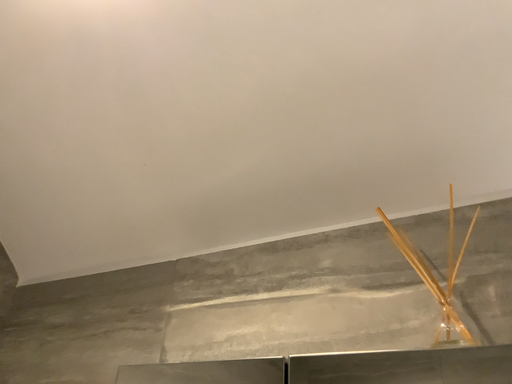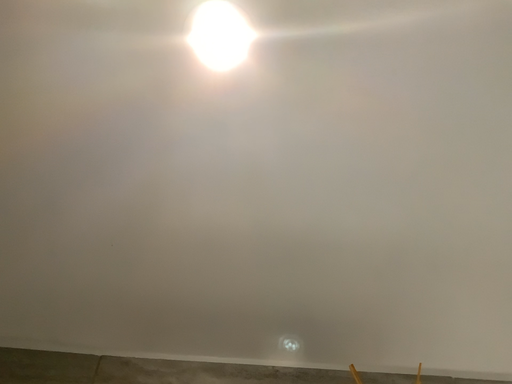
Question: How did the camera likely rotate when shooting the video?

Choices:
 (A) rotated right
 (B) rotated left

Answer: (A)